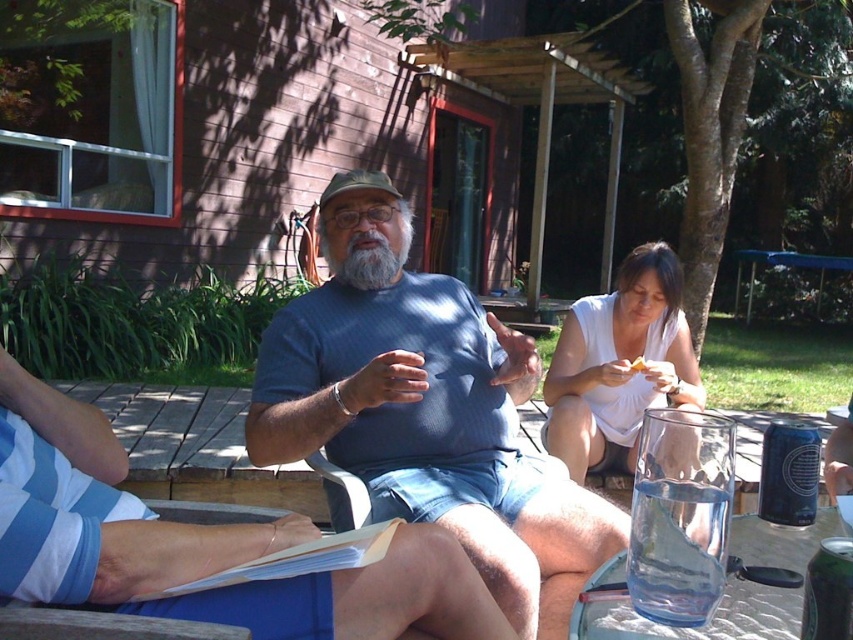
Does white cotton dress at lower right have a smaller size compared to clear glass picnic table at lower right?

Incorrect, white cotton dress at lower right is not smaller in size than clear glass picnic table at lower right.

Is white cotton dress at lower right thinner than clear glass picnic table at lower right?

Yes, white cotton dress at lower right is thinner than clear glass picnic table at lower right.

At what (x,y) coordinates should I click in order to perform the action: click on white cotton dress at lower right. Please return your answer as a coordinate pair (x, y). Looking at the image, I should click on (619, 364).

The width and height of the screenshot is (853, 640). Find the location of `white cotton dress at lower right`. white cotton dress at lower right is located at coordinates (619, 364).

From the picture: Does blue striped shirt at center have a lesser width compared to white paper at center?

No, blue striped shirt at center is not thinner than white paper at center.

Is the position of blue striped shirt at center more distant than that of white paper at center?

No, blue striped shirt at center is closer to the viewer.

This screenshot has width=853, height=640. What do you see at coordinates (96, 509) in the screenshot?
I see `blue striped shirt at center` at bounding box center [96, 509].

Locate an element on the screen. blue striped shirt at center is located at coordinates (96, 509).

Which is below, blue textured shirt at center or white cotton dress at lower right?

white cotton dress at lower right

Who is taller, blue textured shirt at center or white cotton dress at lower right?

Standing taller between the two is blue textured shirt at center.

Is point (328, 289) in front of point (579, 454)?

Yes, it is in front of point (579, 454).

Identify the location of blue textured shirt at center. (425, 410).